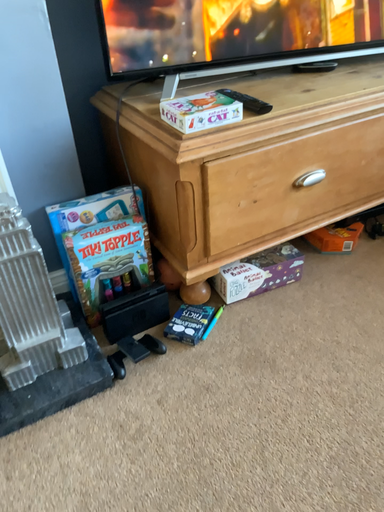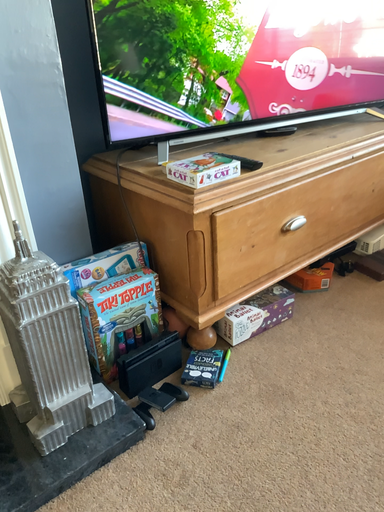
Question: Which way did the camera rotate in the video?

Choices:
 (A) rotated right
 (B) rotated left

Answer: (A)